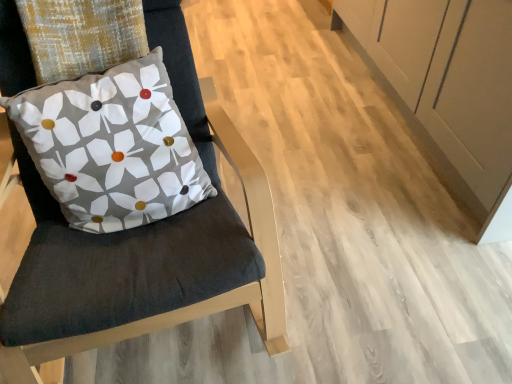
This screenshot has width=512, height=384. What are the coordinates of `velvet cushion at left` in the screenshot? It's located at point(145,245).

In order to face velvet cushion at left, should I rotate leftwards or rightwards?

Turn left approximately 18.087 degrees to face it.

What do you see at coordinates (145, 245) in the screenshot?
I see `velvet cushion at left` at bounding box center [145, 245].

This screenshot has width=512, height=384. What do you see at coordinates (112, 146) in the screenshot?
I see `matte fabric pillow at left` at bounding box center [112, 146].

What are the coordinates of `matte fabric pillow at left` in the screenshot? It's located at tap(112, 146).

You are a GUI agent. You are given a task and a screenshot of the screen. Output one action in this format:
    pyautogui.click(x=<x>, y=<y>)
    Task: Click on the velvet cushion at left
    The height and width of the screenshot is (384, 512).
    Given the screenshot: What is the action you would take?
    pyautogui.click(x=145, y=245)

Visually, is matte fabric pillow at left positioned to the left or to the right of velvet cushion at left?

In the image, matte fabric pillow at left appears on the left side of velvet cushion at left.

Which object is further away from the camera, matte fabric pillow at left or velvet cushion at left?

matte fabric pillow at left is further away from the camera.

Considering the points (176, 198) and (153, 7), which point is behind, point (176, 198) or point (153, 7)?

Positioned behind is point (153, 7).

From the image's perspective, would you say matte fabric pillow at left is shown under velvet cushion at left?

No, from the image's perspective, matte fabric pillow at left is not below velvet cushion at left.

From a real-world perspective, who is located lower, matte fabric pillow at left or velvet cushion at left?

velvet cushion at left.

Does matte fabric pillow at left have a lesser width compared to velvet cushion at left?

Correct, the width of matte fabric pillow at left is less than that of velvet cushion at left.

Can you confirm if matte fabric pillow at left is shorter than velvet cushion at left?

Yes.

Looking at the image, does matte fabric pillow at left seem bigger or smaller compared to velvet cushion at left?

Considering their sizes, matte fabric pillow at left takes up less space than velvet cushion at left.

Does matte fabric pillow at left contain velvet cushion at left?

No, matte fabric pillow at left does not contain velvet cushion at left.

Would you consider matte fabric pillow at left to be distant from velvet cushion at left?

No, matte fabric pillow at left is not far away from velvet cushion at left.

Does matte fabric pillow at left turn towards velvet cushion at left?

Yes.

How many degrees apart are the facing directions of matte fabric pillow at left and velvet cushion at left?

6.28 degrees separate the facing orientations of matte fabric pillow at left and velvet cushion at left.

Find the location of a particular element. pillow behind the velvet cushion at left is located at coordinates (112, 146).

Between velvet cushion at left and matte fabric pillow at left, which one appears on the left side from the viewer's perspective?

→ matte fabric pillow at left.

Consider the image. Which object is closer to the camera taking this photo, velvet cushion at left or matte fabric pillow at left?

Positioned in front is velvet cushion at left.

Does point (233, 247) lie in front of point (94, 160)?

Yes, it is in front of point (94, 160).

From the image's perspective, does velvet cushion at left appear higher than matte fabric pillow at left?

Incorrect, from the image's perspective, velvet cushion at left is lower than matte fabric pillow at left.

From a real-world perspective, is velvet cushion at left positioned over matte fabric pillow at left based on gravity?

Incorrect, from a real-world perspective, velvet cushion at left is lower than matte fabric pillow at left.

Is velvet cushion at left wider than matte fabric pillow at left?

Yes, velvet cushion at left is wider than matte fabric pillow at left.

Between velvet cushion at left and matte fabric pillow at left, which one has less height?

Standing shorter between the two is matte fabric pillow at left.

Considering the sizes of objects velvet cushion at left and matte fabric pillow at left in the image provided, who is bigger, velvet cushion at left or matte fabric pillow at left?

With larger size is velvet cushion at left.

Choose the correct answer: Is velvet cushion at left inside matte fabric pillow at left or outside it?

velvet cushion at left is located beyond the bounds of matte fabric pillow at left.

Is velvet cushion at left positioned far away from matte fabric pillow at left?

No.

Is matte fabric pillow at left at the back of velvet cushion at left?

Yes, velvet cushion at left's orientation is away from matte fabric pillow at left.

Find the location of a particular element. This screenshot has width=512, height=384. chair below the matte fabric pillow at left (from the image's perspective) is located at coordinates (145, 245).

What are the coordinates of `pillow that is on the left side of velvet cushion at left` in the screenshot? It's located at (112, 146).

In order to click on chair in front of the matte fabric pillow at left in this screenshot , I will do `click(145, 245)`.